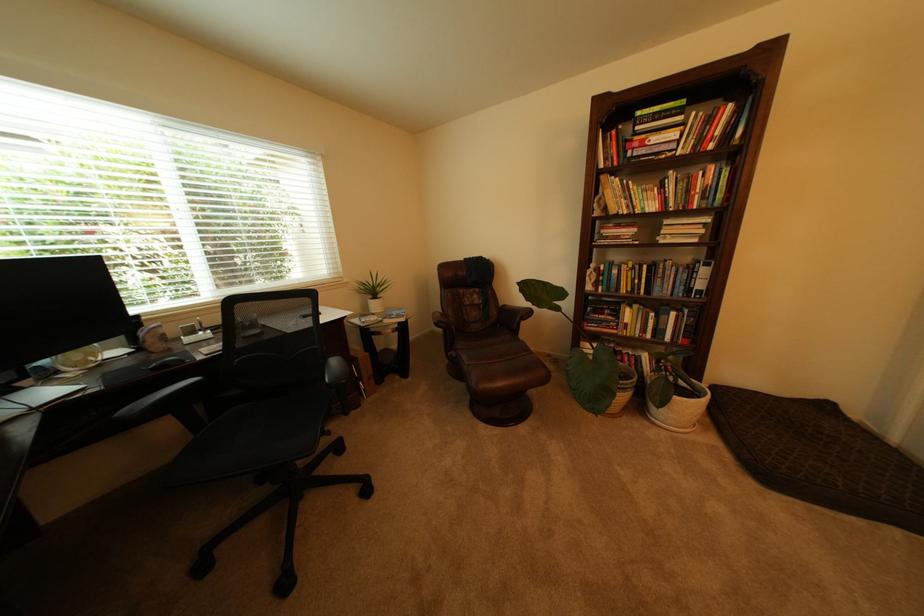
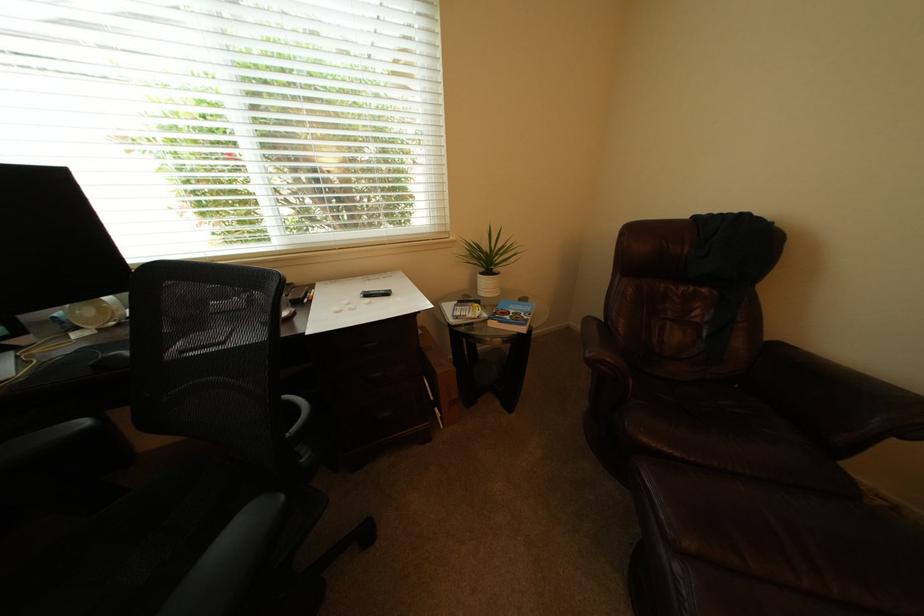
Find the pixel in the second image that matches point (358, 284) in the first image.

(466, 243)